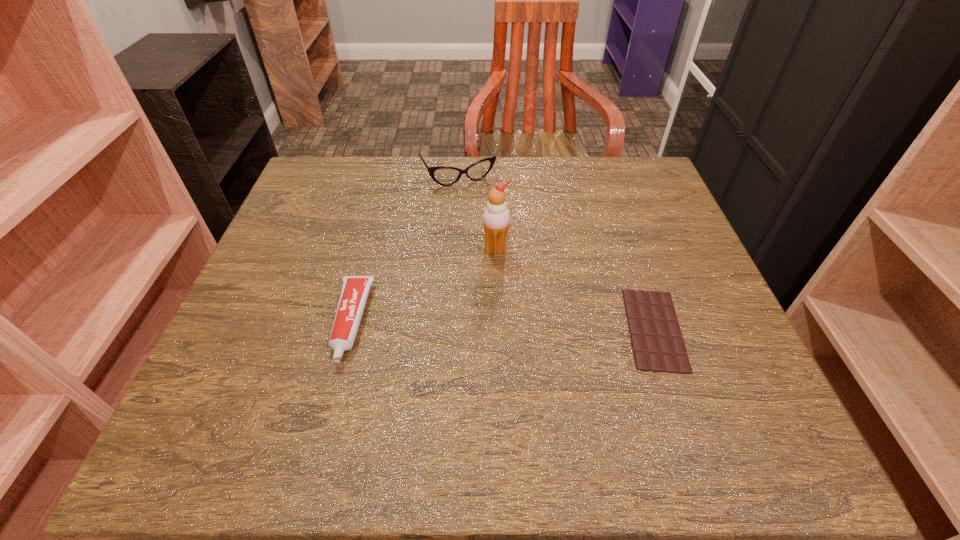
At what (x,y) coordinates should I click in order to perform the action: click on the third tallest object. Please return your answer as a coordinate pair (x, y). The image size is (960, 540). Looking at the image, I should click on (355, 289).

Where is `the leftmost object`? the leftmost object is located at coordinates (355, 289).

Where is `chocolate bar`? chocolate bar is located at coordinates (658, 346).

The width and height of the screenshot is (960, 540). Identify the location of the shortest object. (658, 346).

At what (x,y) coordinates should I click in order to perform the action: click on the second farthest object. Please return your answer as a coordinate pair (x, y). Looking at the image, I should click on (496, 218).

Find the location of a particular element. This screenshot has height=540, width=960. the tallest object is located at coordinates (496, 218).

The width and height of the screenshot is (960, 540). I want to click on spectacles, so click(443, 175).

The image size is (960, 540). I want to click on the third shortest object, so click(x=443, y=175).

You are a GUI agent. You are given a task and a screenshot of the screen. Output one action in this format:
    pyautogui.click(x=<x>, y=<y>)
    Task: Click on the vacant space situated on the left of the shortest object
    
    Given the screenshot: What is the action you would take?
    pyautogui.click(x=560, y=329)

Where is `free point located 0.300m at the front with a straw on the icecream`? This screenshot has width=960, height=540. free point located 0.300m at the front with a straw on the icecream is located at coordinates (555, 377).